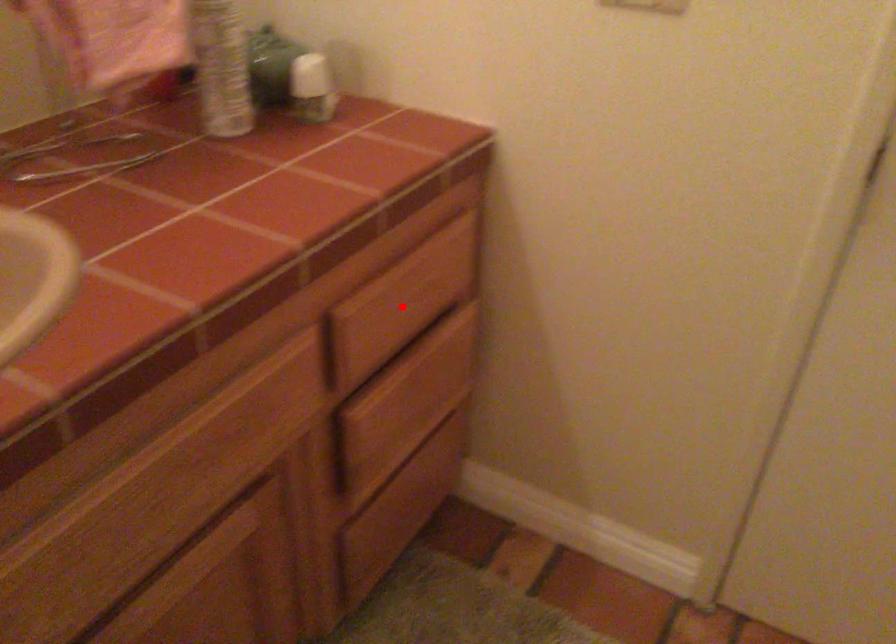
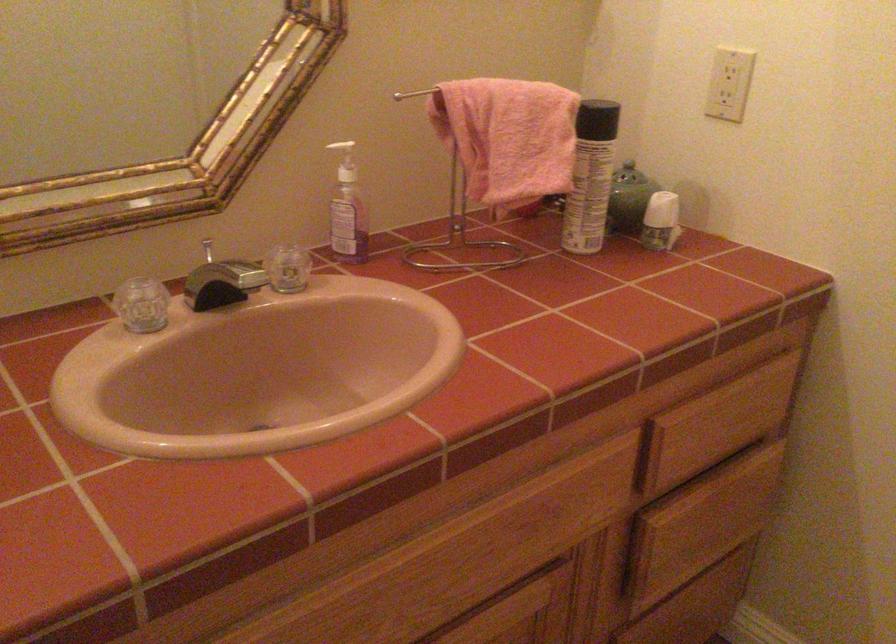
Where in the second image is the point corresponding to the highlighted location from the first image?

(718, 424)